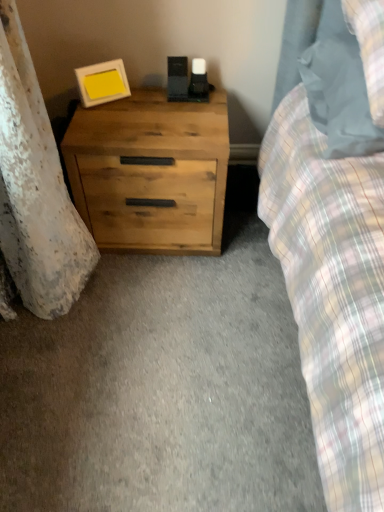
The image size is (384, 512). I want to click on free point above natural wood chest of drawers at lower left (from a real-world perspective), so click(158, 111).